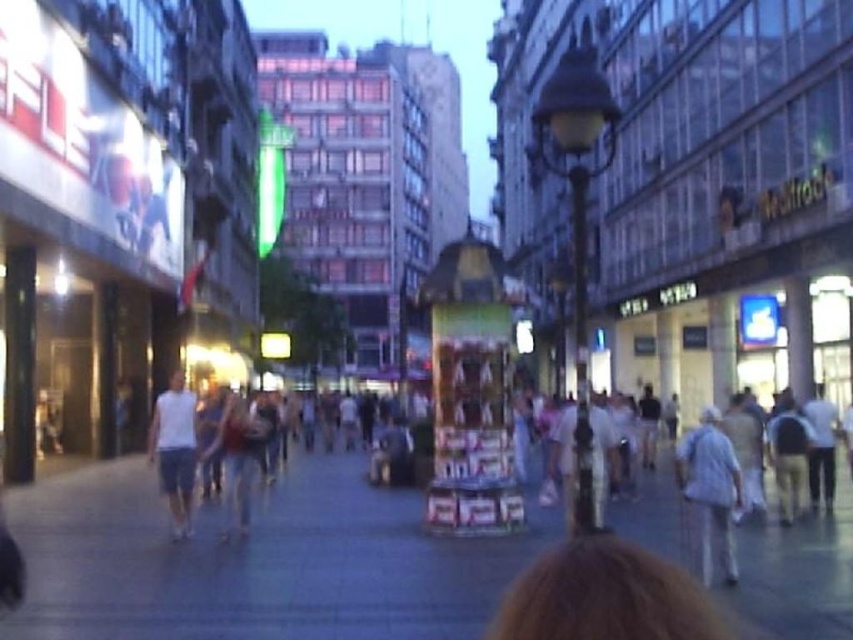
Question: In this image, where is gray concrete sidewalk at center located relative to white cotton shirt at lower right?

Choices:
 (A) below
 (B) above

Answer: (A)

Question: Which of the following is the closest to the observer?

Choices:
 (A) (363, 506)
 (B) (154, 433)
 (C) (728, 577)

Answer: (C)

Question: Among these points, which one is farthest from the camera?

Choices:
 (A) (151, 528)
 (B) (184, 522)
 (C) (717, 416)

Answer: (A)

Question: Can you confirm if gray concrete sidewalk at center is positioned above white cotton shirt at lower right?

Choices:
 (A) yes
 (B) no

Answer: (B)

Question: Can you confirm if white cotton shirt at lower right is positioned above white cotton t-shirt at left?

Choices:
 (A) no
 (B) yes

Answer: (A)

Question: Which point is farther to the camera?

Choices:
 (A) (x=160, y=396)
 (B) (x=704, y=445)
 (C) (x=82, y=483)

Answer: (A)